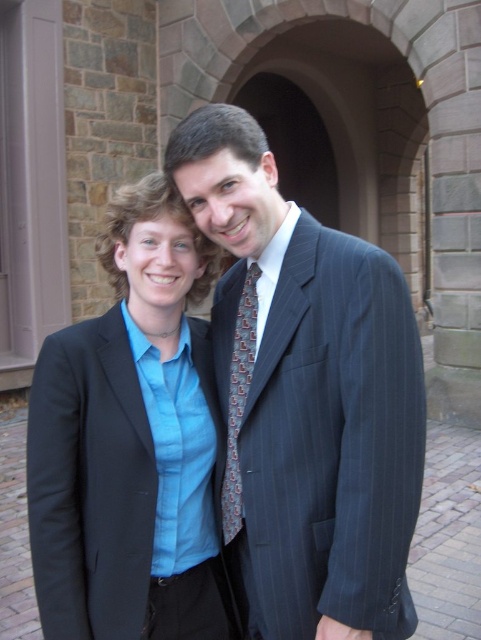
Question: Is matte blue shirt at center to the left of patterned silk tie at center from the viewer's perspective?

Choices:
 (A) yes
 (B) no

Answer: (A)

Question: Does pinstriped suit at center have a larger size compared to matte blue shirt at center?

Choices:
 (A) yes
 (B) no

Answer: (A)

Question: Which of the following is the closest to the observer?

Choices:
 (A) (206, 403)
 (B) (240, 404)

Answer: (B)

Question: Estimate the real-world distances between objects in this image. Which object is farther from the patterned silk tie at center?

Choices:
 (A) matte blue shirt at center
 (B) pinstriped suit at center

Answer: (A)

Question: Is pinstriped suit at center smaller than matte blue shirt at center?

Choices:
 (A) yes
 (B) no

Answer: (B)

Question: Which object is the closest to the matte blue shirt at center?

Choices:
 (A) pinstriped suit at center
 (B) patterned silk tie at center

Answer: (B)